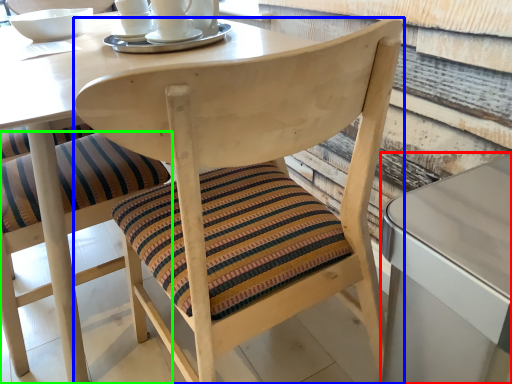
Question: Which object is positioned farthest from table (highlighted by a red box)? Select from chair (highlighted by a blue box) and chair (highlighted by a green box).

Choices:
 (A) chair
 (B) chair

Answer: (B)